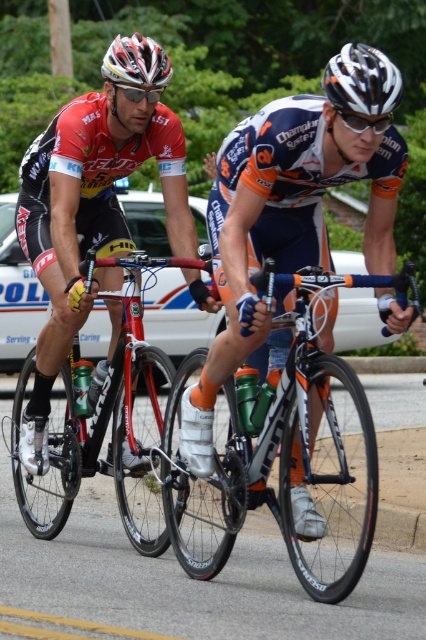
Question: Among these objects, which one is nearest to the camera?

Choices:
 (A) matte black bicycle at left
 (B) white matte bicycle helmet at upper center
 (C) shiny red bicycle at center

Answer: (B)

Question: Is the position of orange jersey at center less distant than that of matte black bicycle at left?

Choices:
 (A) no
 (B) yes

Answer: (B)

Question: Which point is closer to the camera?

Choices:
 (A) (322, 76)
 (B) (299, 552)

Answer: (B)

Question: Can you confirm if matte black bicycle at left is smaller than shiny red bicycle at center?

Choices:
 (A) no
 (B) yes

Answer: (B)

Question: Is orange jersey at center below shiny red bicycle at center?

Choices:
 (A) yes
 (B) no

Answer: (B)

Question: Which point is closer to the camera?

Choices:
 (A) orange jersey at center
 (B) white matte bicycle helmet at upper center
 (C) matte black bicycle at left
 (D) shiny red bicycle at center

Answer: (A)